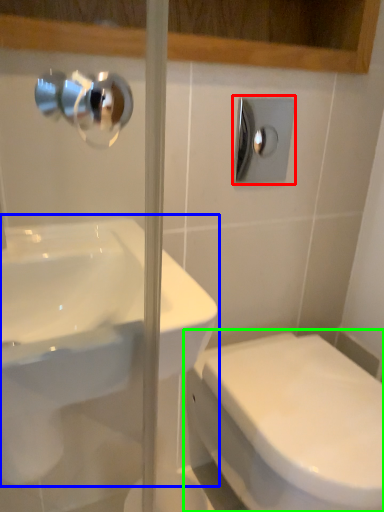
Question: Which is nearer to the shower (highlighted by a red box)? sink (highlighted by a blue box) or toilet (highlighted by a green box).

Choices:
 (A) sink
 (B) toilet

Answer: (A)